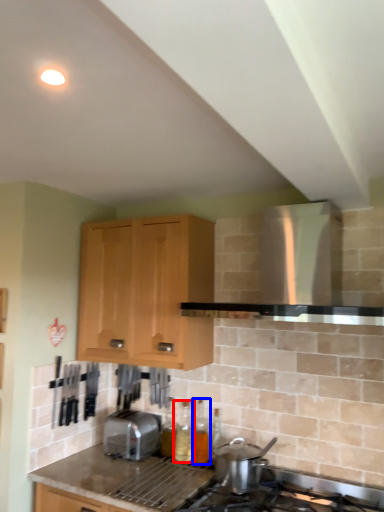
Question: Which of the following is the farthest to the observer, bottle (highlighted by a red box) or bottle (highlighted by a blue box)?

Choices:
 (A) bottle
 (B) bottle

Answer: (A)